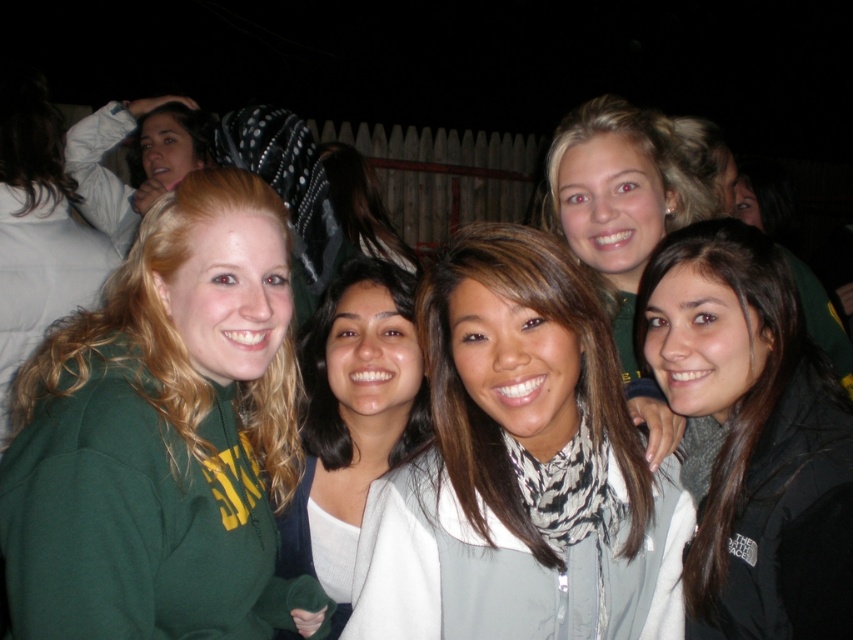
Describe the element at coordinates (158, 435) in the screenshot. I see `green fleece sweatshirt at left` at that location.

From the picture: Is green fleece sweatshirt at left smaller than white textured scarf at center?

No, green fleece sweatshirt at left is not smaller than white textured scarf at center.

Describe the element at coordinates (158, 435) in the screenshot. This screenshot has width=853, height=640. I see `green fleece sweatshirt at left` at that location.

I want to click on green fleece sweatshirt at left, so click(x=158, y=435).

Between point (672, 580) and point (718, 593), which one is positioned behind?

The point (672, 580) is more distant.

Which is above, white textured scarf at center or black fleece jacket at lower right?

Positioned higher is black fleece jacket at lower right.

I want to click on white textured scarf at center, so click(x=518, y=464).

Which of these two, green fleece sweatshirt at left or white matte scarf at center, stands shorter?

Standing shorter between the two is white matte scarf at center.

Can you confirm if green fleece sweatshirt at left is shorter than white matte scarf at center?

In fact, green fleece sweatshirt at left may be taller than white matte scarf at center.

The image size is (853, 640). In order to click on green fleece sweatshirt at left in this screenshot , I will do `click(158, 435)`.